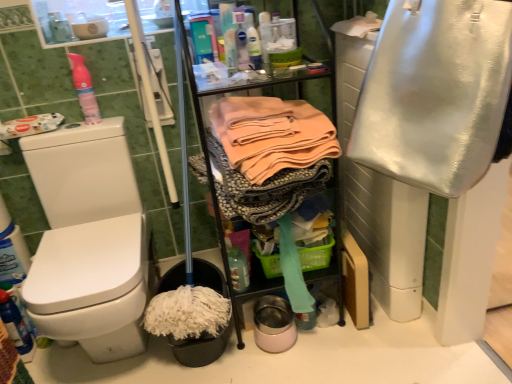
Where is `vacant area situated below shiny metallic bag at right, acting as the 2th clothing starting from the left (from a real-world perspective)`? The width and height of the screenshot is (512, 384). vacant area situated below shiny metallic bag at right, acting as the 2th clothing starting from the left (from a real-world perspective) is located at coordinates (431, 366).